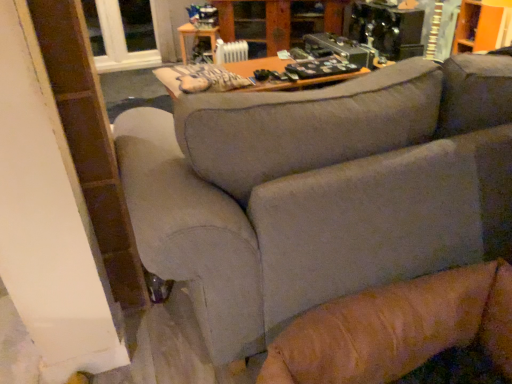
Question: Should I look upward or downward to see gray fabric couch at center?

Choices:
 (A) up
 (B) down

Answer: (A)

Question: Does clear glass window at upper left appear on the right side of white plastic radiator at upper center?

Choices:
 (A) yes
 (B) no

Answer: (B)

Question: Does clear glass window at upper left have a greater height compared to white plastic radiator at upper center?

Choices:
 (A) no
 (B) yes

Answer: (B)

Question: Is clear glass window at upper left positioned far away from white plastic radiator at upper center?

Choices:
 (A) yes
 (B) no

Answer: (A)

Question: From the image's perspective, is clear glass window at upper left under white plastic radiator at upper center?

Choices:
 (A) yes
 (B) no

Answer: (B)

Question: Can you confirm if clear glass window at upper left is wider than white plastic radiator at upper center?

Choices:
 (A) no
 (B) yes

Answer: (B)

Question: From a real-world perspective, is clear glass window at upper left over white plastic radiator at upper center?

Choices:
 (A) yes
 (B) no

Answer: (A)

Question: Is wooden cabinet at upper center far away from gray fabric couch at center?

Choices:
 (A) no
 (B) yes

Answer: (B)

Question: Would you say gray fabric couch at center is part of wooden cabinet at upper center's contents?

Choices:
 (A) no
 (B) yes

Answer: (A)

Question: Is wooden cabinet at upper center thinner than gray fabric couch at center?

Choices:
 (A) yes
 (B) no

Answer: (A)

Question: Considering the relative sizes of wooden cabinet at upper center and gray fabric couch at center in the image provided, is wooden cabinet at upper center smaller than gray fabric couch at center?

Choices:
 (A) no
 (B) yes

Answer: (B)

Question: From the image's perspective, is wooden cabinet at upper center located above gray fabric couch at center?

Choices:
 (A) no
 (B) yes

Answer: (B)

Question: Is wooden cabinet at upper center to the left of gray fabric couch at center from the viewer's perspective?

Choices:
 (A) no
 (B) yes

Answer: (B)

Question: Is wooden cabinet at upper center turned away from white plastic radiator at upper center?

Choices:
 (A) yes
 (B) no

Answer: (B)